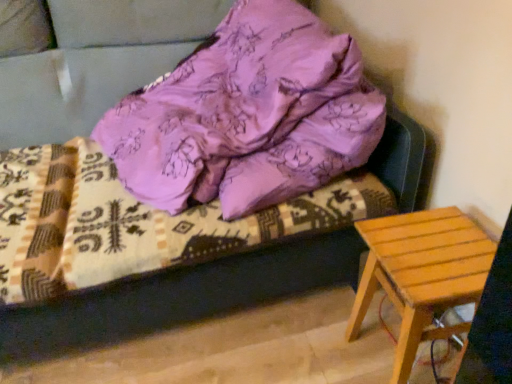
Find the location of a particular element. vacant point to the left of light brown wooden stool at lower right is located at coordinates (x=308, y=342).